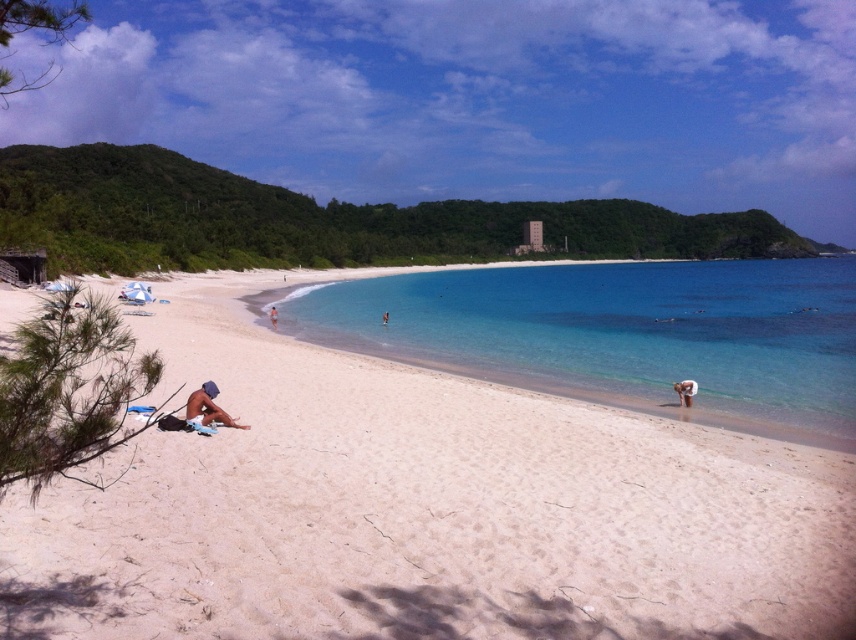
You are standing on the beach and want to walk to the clear blue water at center. Which direction should you move relative to the brown sand at lower center?

You should move towards the clear blue water at center, which is located above the brown sand at lower center since it is much taller.